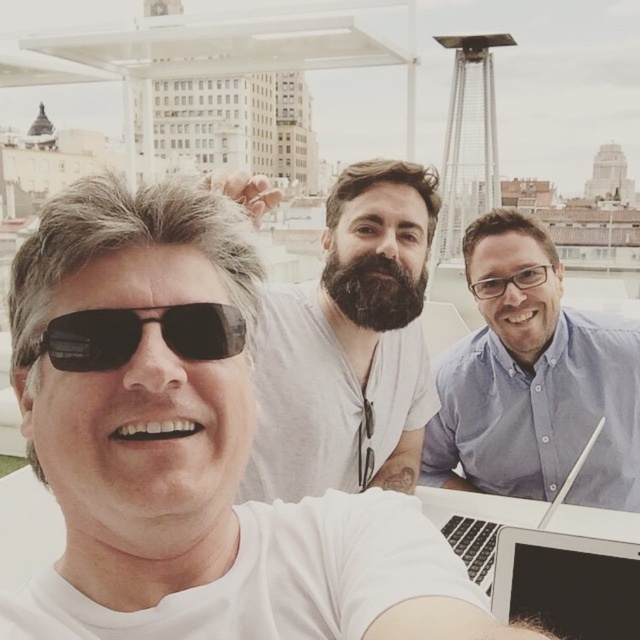
Question: Is bearded man at center smaller than black matte sunglasses at center?

Choices:
 (A) yes
 (B) no

Answer: (B)

Question: Which object is the closest to the bearded man at center?

Choices:
 (A) silver metallic laptop at lower right
 (B) blue button-down shirt at center
 (C) black matte sunglasses at center

Answer: (B)

Question: From the image, what is the correct spatial relationship of bearded man at center in relation to blue button-down shirt at center?

Choices:
 (A) below
 (B) above

Answer: (B)

Question: Which is farther from the silver metallic laptop at lower right?

Choices:
 (A) blue button-down shirt at center
 (B) black matte sunglasses at center
 (C) silver metallic laptop at center

Answer: (B)

Question: Which point appears closest to the camera in this image?

Choices:
 (A) (422, 490)
 (B) (589, 404)
 (C) (189, 321)

Answer: (C)

Question: Can you confirm if blue button-down shirt at center is thinner than silver metallic laptop at lower right?

Choices:
 (A) yes
 (B) no

Answer: (B)